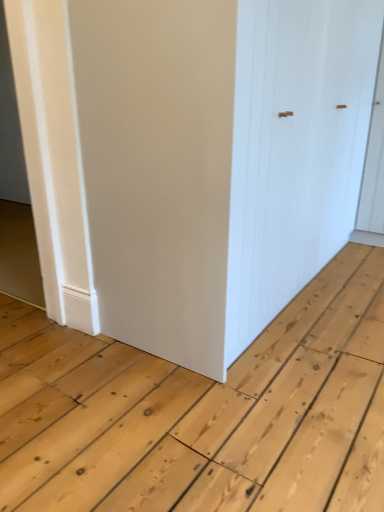
Identify the location of white matte door at center. (188, 160).

Describe the element at coordinates (188, 160) in the screenshot. I see `white matte door at center` at that location.

You are a GUI agent. You are given a task and a screenshot of the screen. Output one action in this format:
    pyautogui.click(x=<x>, y=<y>)
    Task: Click on the white matte door at center
    The height and width of the screenshot is (512, 384).
    Given the screenshot: What is the action you would take?
    pyautogui.click(x=188, y=160)